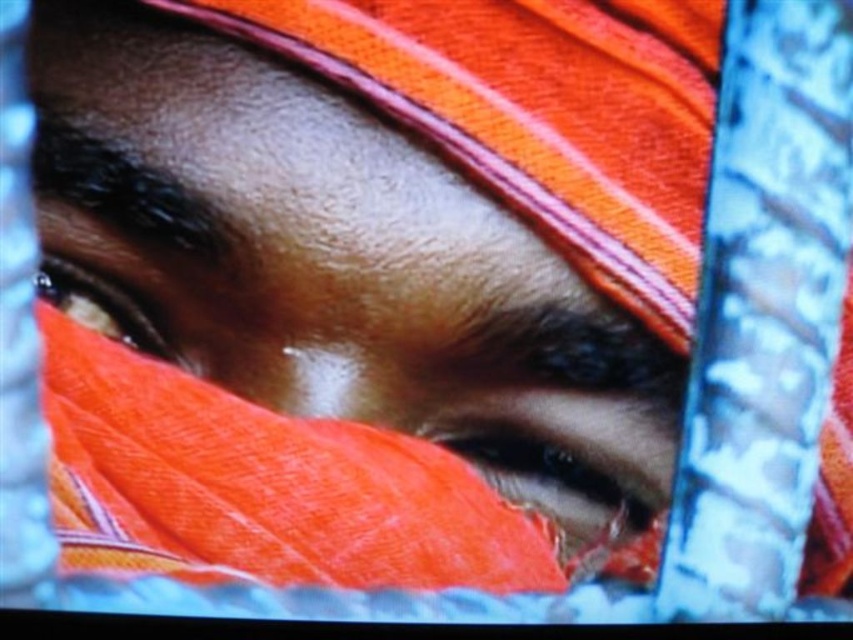
Which is in front, point (547, 497) or point (114, 284)?

Positioned in front is point (114, 284).

This screenshot has height=640, width=853. Find the location of `matte orange eye at center`. matte orange eye at center is located at coordinates (566, 461).

Is point (451, 502) behind point (62, 272)?

Yes, it is.

Locate an element on the screen. orange fabric at center is located at coordinates (260, 486).

Find the location of a particular element. The width and height of the screenshot is (853, 640). orange fabric at center is located at coordinates (260, 486).

Can you confirm if orange fabric at center is positioned above matte orange eye at center?

Actually, orange fabric at center is below matte orange eye at center.

Is orange fabric at center wider than matte orange eye at center?

Yes, orange fabric at center is wider than matte orange eye at center.

You are a GUI agent. You are given a task and a screenshot of the screen. Output one action in this format:
    pyautogui.click(x=<x>, y=<y>)
    Task: Click on the orange fabric at center
    
    Given the screenshot: What is the action you would take?
    pyautogui.click(x=260, y=486)